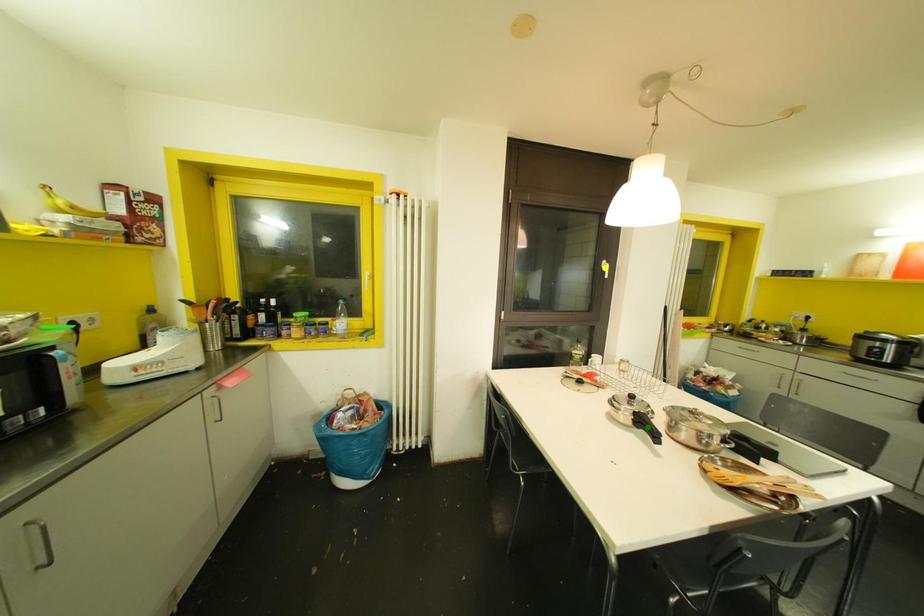
Order these from nearest to farthest:
A) orange point
B) green point
C) yellow point

orange point, green point, yellow point